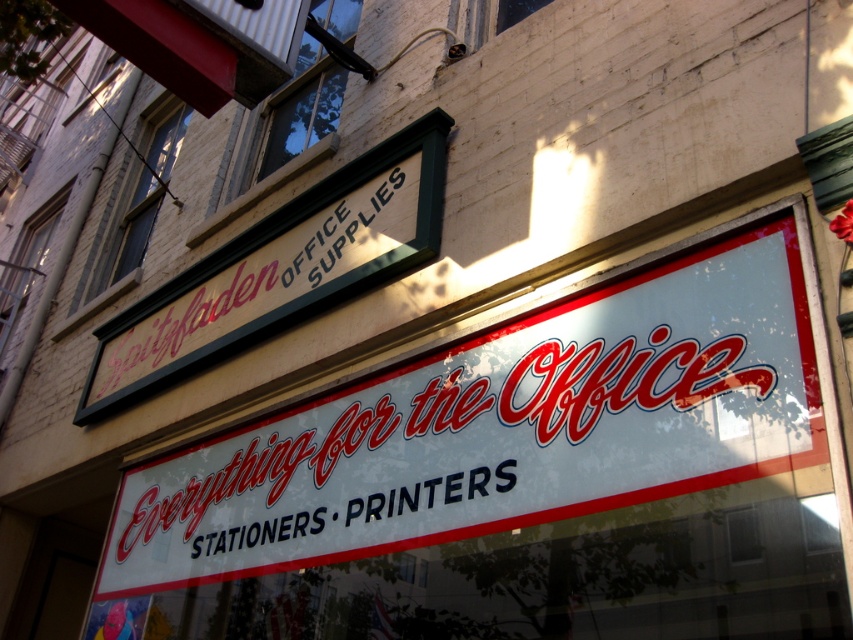
What is the color of the signboard at the point specified by the coordinates point (280, 268)?

The point (280, 268) corresponds to the matte green signboard at upper left.

You are an office manager planning to install a new sign. You have two options displayed in the scene. Which one is taller between the white plastic sign at center and the white matte signboard at center?

The white plastic sign at center is taller than the white matte signboard at center according to the description.